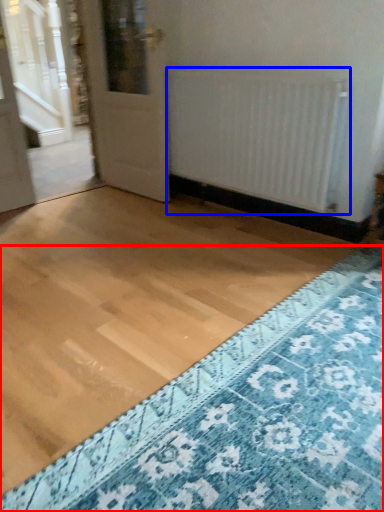
Question: Among these objects, which one is nearest to the camera, doormat (highlighted by a red box) or radiator (highlighted by a blue box)?

Choices:
 (A) doormat
 (B) radiator

Answer: (A)